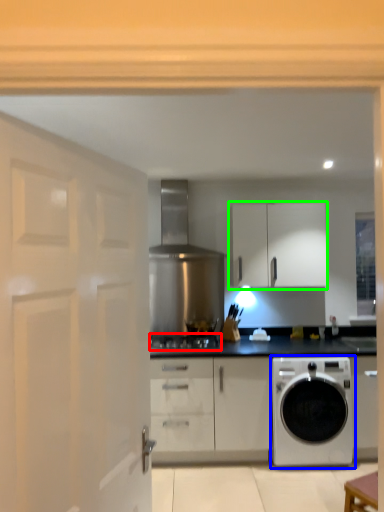
Question: Which is farther away from gas stove (highlighted by a red box)? washing machine (highlighted by a blue box) or cabinetry (highlighted by a green box)?

Choices:
 (A) washing machine
 (B) cabinetry

Answer: (B)